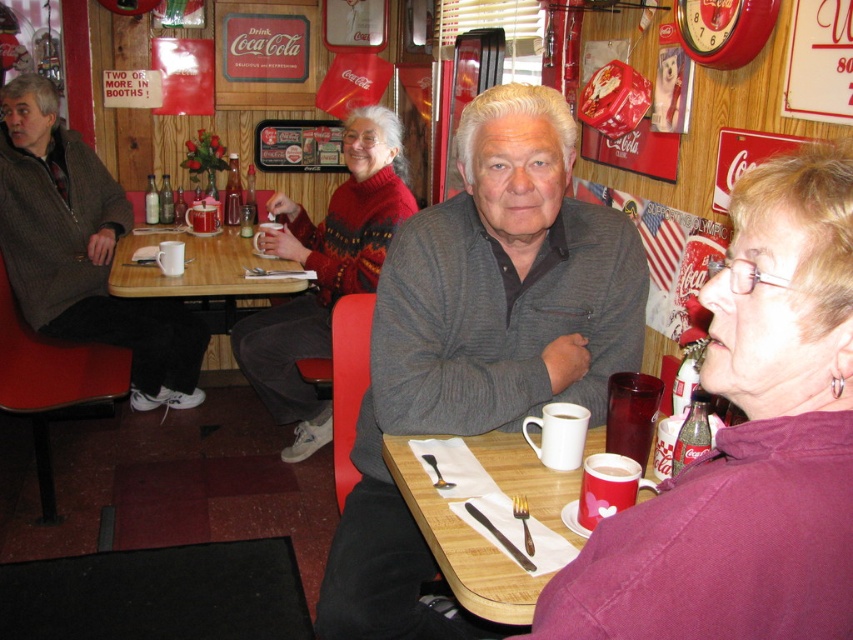
In the diner scene, there is a purple fabric shirt at upper right. Where exactly is it located in terms of coordinates?

The purple fabric shirt at upper right is located at coordinates point [747,444].

You are a customer at this diner and want to grab the brushed metal mug at upper center. However, there is a purple fabric shirt at upper right in the way. Can you reach the mug without moving the shirt?

The purple fabric shirt at upper right is closer to the viewer than the brushed metal mug at upper center, so the shirt is blocking the path to the mug. You would need to move the shirt to access the mug.

You are a customer at the diner and want to place your phone on the table without blocking the brushed metal mug at table center. Where should you place it relative to the gray knit sweater at center?

You should place your phone above the gray knit sweater at center because the gray knit sweater at center is located below the brushed metal mug at table center, so placing the phone above it will keep it out of the mug area.